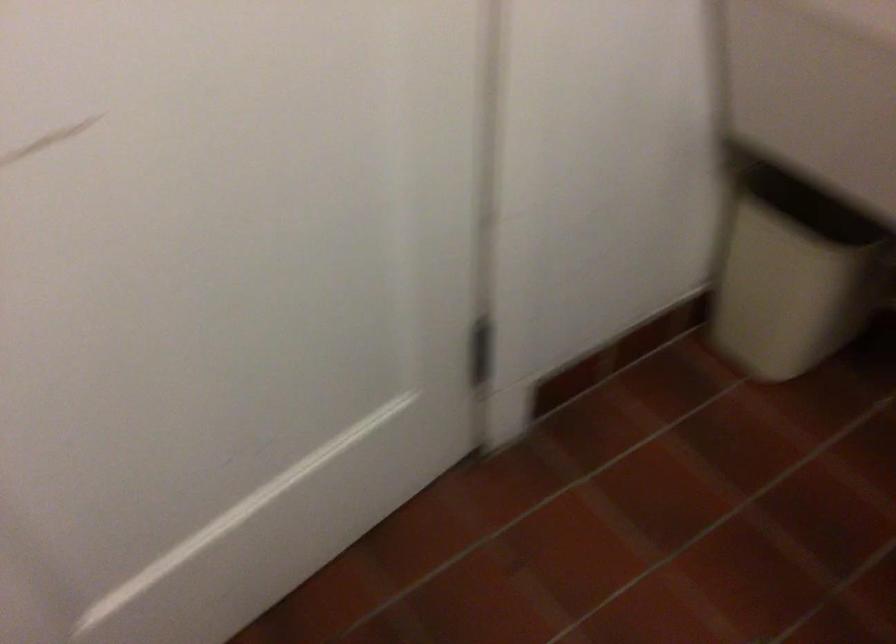
The image size is (896, 644). Identify the location of beige trash can. (794, 272).